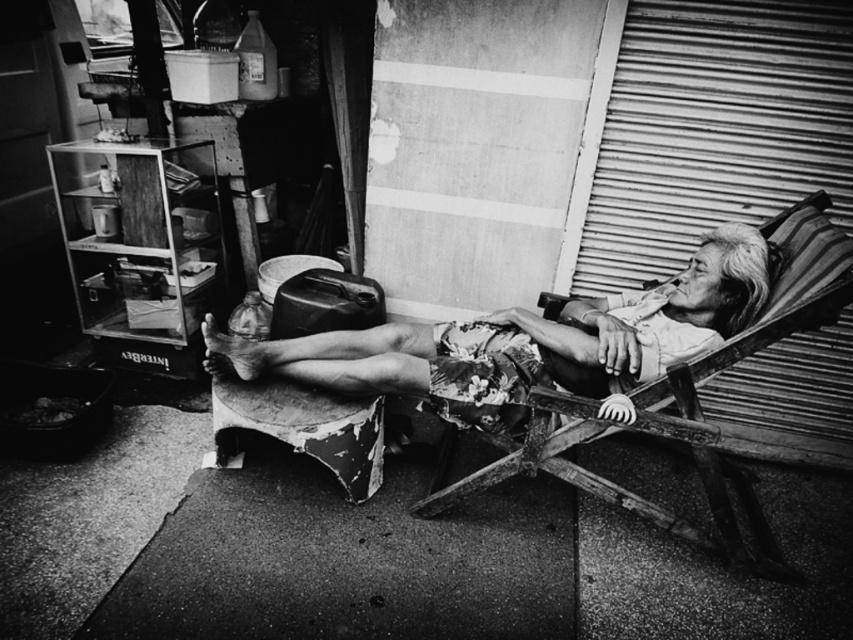
You are a delivery person who needs to place a small package between the floral fabric shorts at center and the wooden daybed at right. Can you fit the package in the space between them if the package is 12 inches long?

The distance between the floral fabric shorts at center and the wooden daybed at right is 13.13 inches. Since the package is 12 inches long, it can fit in the space between them.

Based on the scene described, where exactly is the floral fabric shorts at center positioned in the image?

The floral fabric shorts at center is located at point (531, 340) in the image.